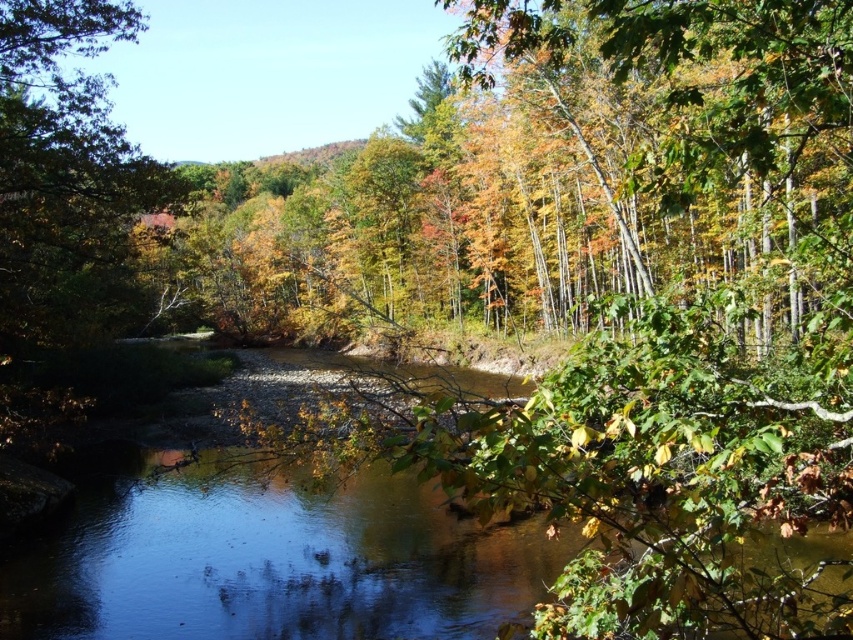
Question: Is clear water at center to the right of green leafy tree at left from the viewer's perspective?

Choices:
 (A) yes
 (B) no

Answer: (A)

Question: Which point is closer to the camera taking this photo?

Choices:
 (A) (479, 548)
 (B) (33, 221)

Answer: (B)

Question: Can you confirm if clear water at center is smaller than green leafy tree at left?

Choices:
 (A) yes
 (B) no

Answer: (A)

Question: Which point appears closest to the camera in this image?

Choices:
 (A) (44, 352)
 (B) (245, 525)

Answer: (B)

Question: Does clear water at center lie behind green leafy tree at left?

Choices:
 (A) no
 (B) yes

Answer: (A)